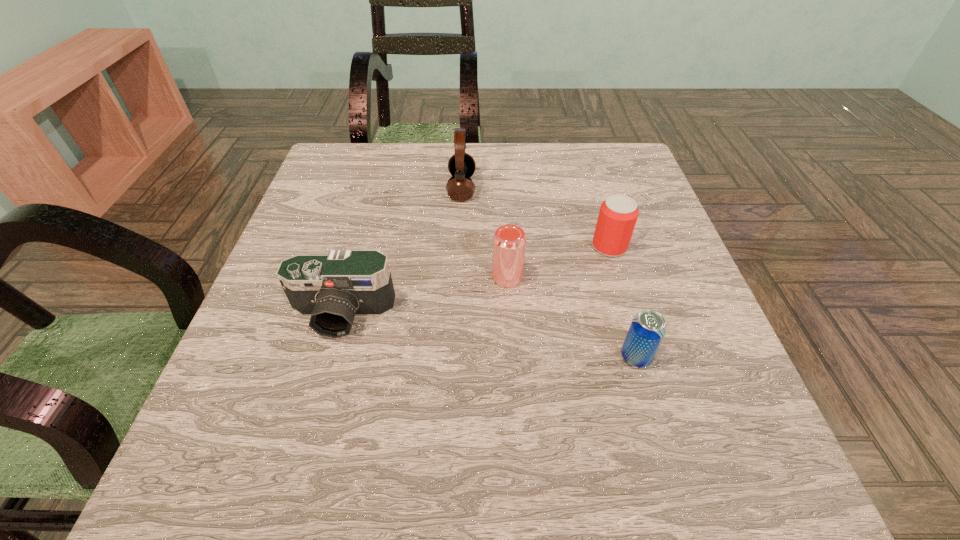
The image size is (960, 540). What are the coordinates of `free space at the near right corner of the desktop` in the screenshot? It's located at (756, 488).

Where is `empty space that is in between the third nearest object and the second farthest object`? The image size is (960, 540). empty space that is in between the third nearest object and the second farthest object is located at coordinates (559, 262).

The image size is (960, 540). What are the coordinates of `unoccupied position between the second object from left to right and the third nearest object` in the screenshot? It's located at (485, 233).

The width and height of the screenshot is (960, 540). What are the coordinates of `empty space between the fourth farthest object and the tallest object` in the screenshot? It's located at (402, 252).

Locate an element on the screen. The height and width of the screenshot is (540, 960). vacant area that lies between the nearest beer can and the farthest beer can is located at coordinates (623, 302).

Locate an element on the screen. This screenshot has height=540, width=960. vacant region between the second farthest object and the leftmost beer can is located at coordinates coord(559,262).

Locate an element on the screen. vacant region between the farthest beer can and the third nearest object is located at coordinates (559, 262).

Locate an element on the screen. free space between the fourth nearest object and the farthest object is located at coordinates (536, 218).

What are the coordinates of `vacant area between the camera and the third object from left to right` in the screenshot? It's located at (424, 296).

You are a GUI agent. You are given a task and a screenshot of the screen. Output one action in this format:
    pyautogui.click(x=<x>, y=<y>)
    Task: Click on the free space between the nearest object and the leftmost beer can
    The height and width of the screenshot is (540, 960).
    Given the screenshot: What is the action you would take?
    pyautogui.click(x=571, y=317)